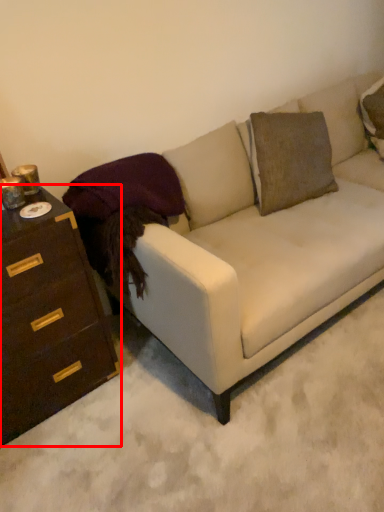
Question: From the image's perspective, where is chest of drawers (annotated by the red box) located in relation to studio couch in the image?

Choices:
 (A) below
 (B) above

Answer: (A)